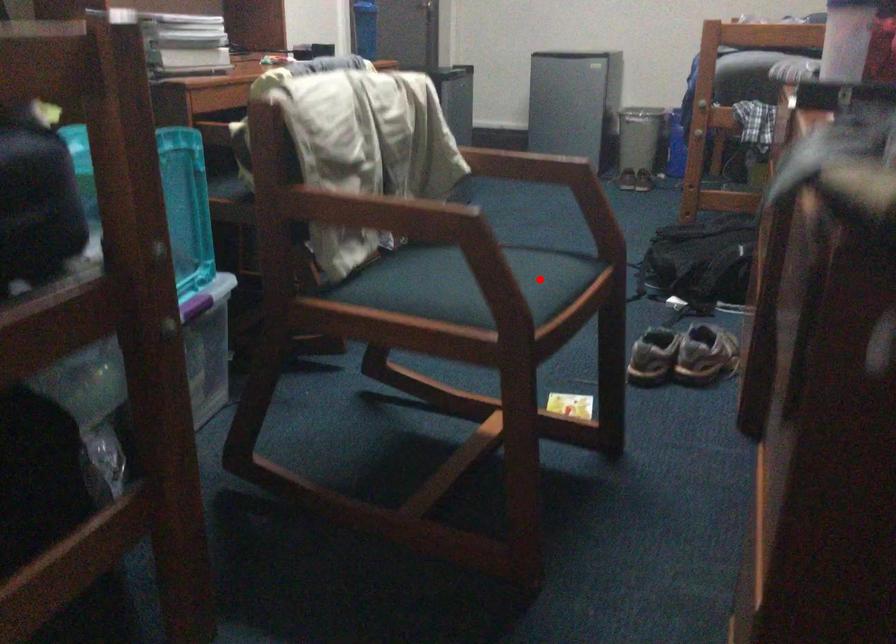
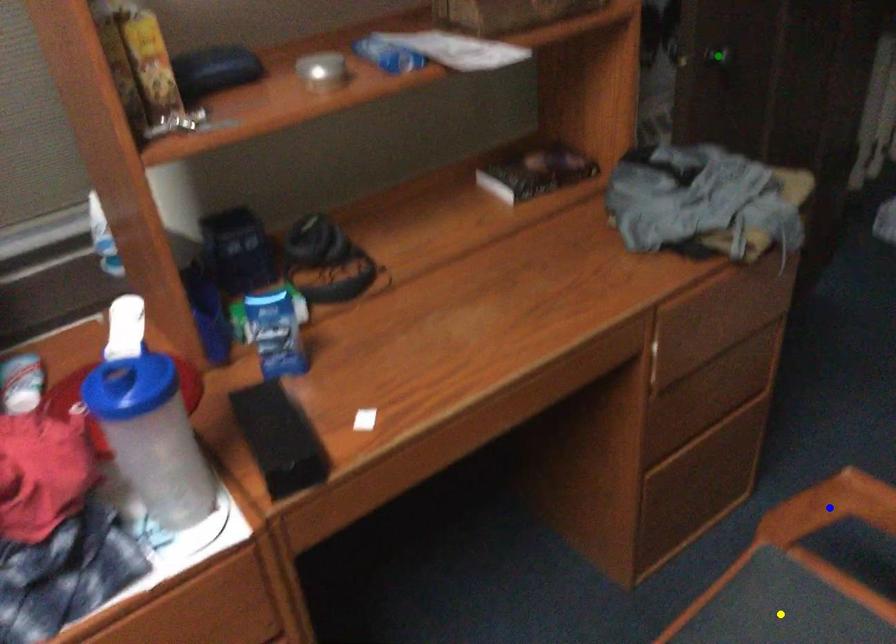
Question: I am providing you with two images of the same scene from different viewpoints. A red point is marked on the first image. You are given multiple points on the second image. Which point in image 2 is actually the same real-world point as the red point in image 1?

Choices:
 (A) green point
 (B) yellow point
 (C) blue point

Answer: (C)